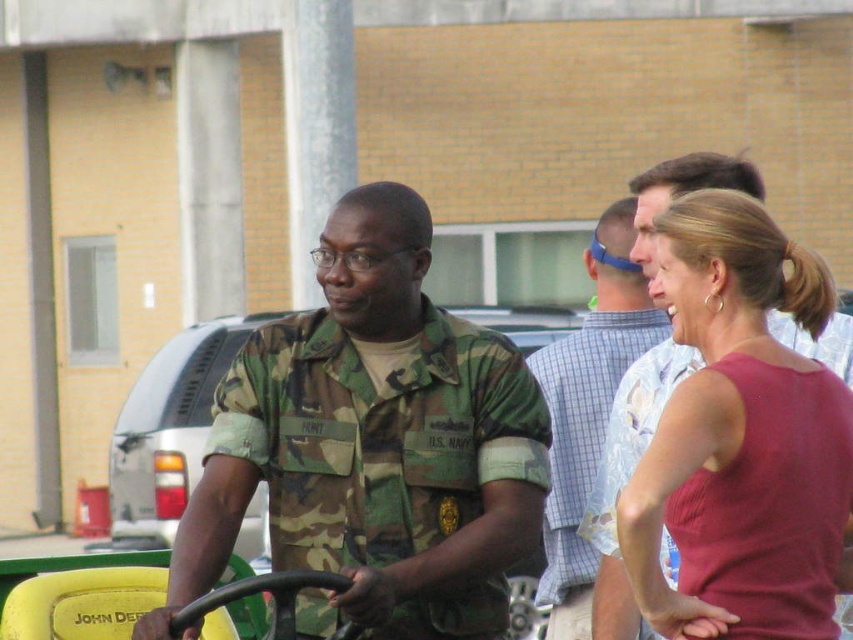
Question: Which is farther from the blue plaid shirt at center?

Choices:
 (A) matte red tank top at center right
 (B) camo uniform at center

Answer: (A)

Question: Which point is closer to the camera?

Choices:
 (A) blue plaid shirt at center
 (B) matte red tank top at center right
 (C) camo uniform at center

Answer: (B)

Question: Which object is closer to the camera taking this photo?

Choices:
 (A) camo uniform at center
 (B) blue plaid shirt at center
 (C) matte red tank top at center right

Answer: (C)

Question: Does camo uniform at center appear over blue plaid shirt at center?

Choices:
 (A) yes
 (B) no

Answer: (B)

Question: Where is camo uniform at center located in relation to matte red tank top at center right in the image?

Choices:
 (A) right
 (B) left

Answer: (B)

Question: Is camo uniform at center to the left of blue plaid shirt at center from the viewer's perspective?

Choices:
 (A) no
 (B) yes

Answer: (B)